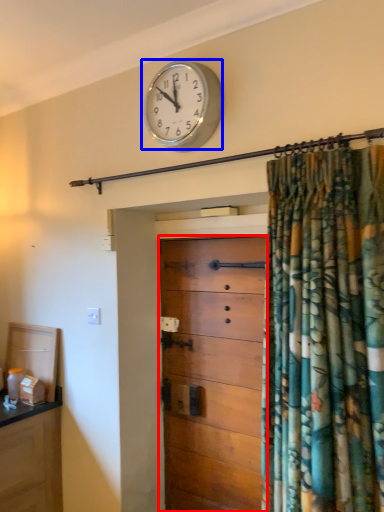
Question: Among these objects, which one is farthest to the camera, chest of drawers (highlighted by a red box) or wall clock (highlighted by a blue box)?

Choices:
 (A) chest of drawers
 (B) wall clock

Answer: (A)